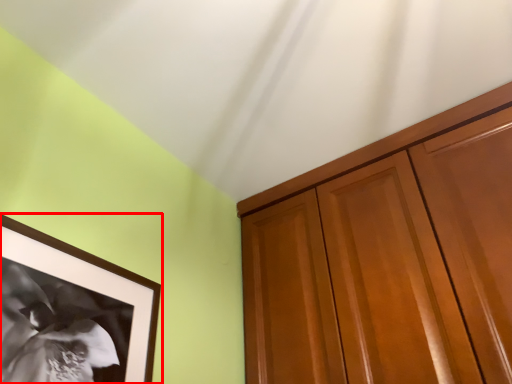
Question: From the image's perspective, where is picture frame (annotated by the red box) located relative to cabinetry?

Choices:
 (A) below
 (B) above

Answer: (A)